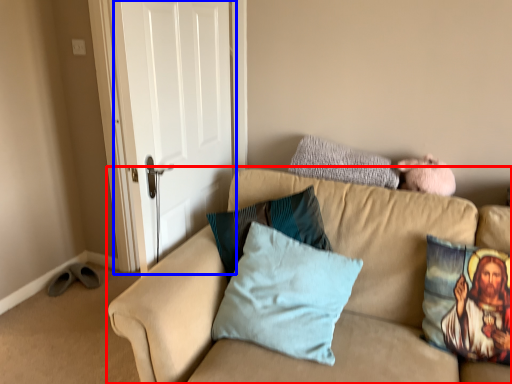
Question: Which object appears farthest to the camera in this image, studio couch (highlighted by a red box) or door (highlighted by a blue box)?

Choices:
 (A) studio couch
 (B) door

Answer: (B)